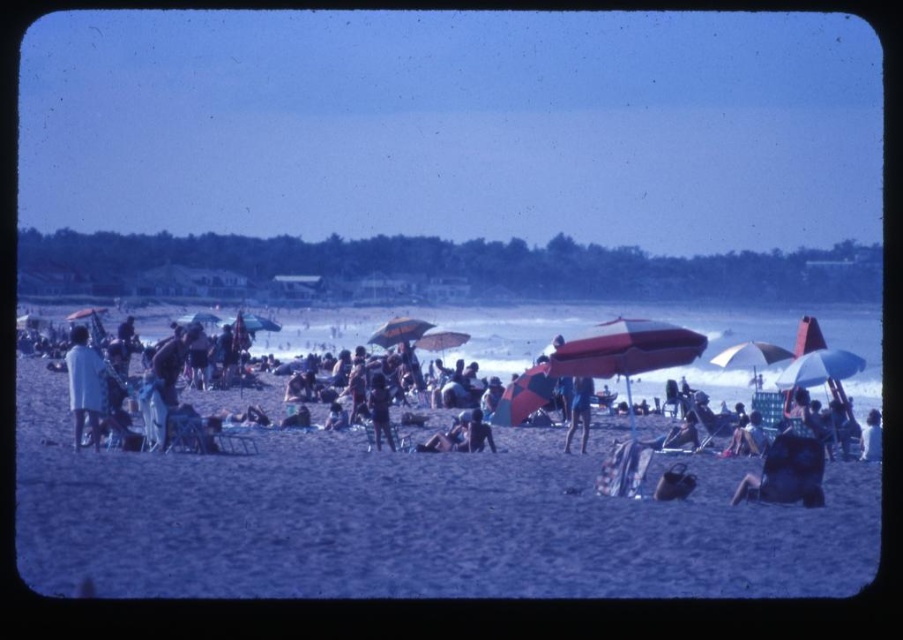
Where is `yellow fabric umbrella at center`? yellow fabric umbrella at center is located at coordinates (399, 332).

Looking at this image, can you confirm if yellow fabric umbrella at center is positioned to the right of red fabric umbrella at center?

Correct, you'll find yellow fabric umbrella at center to the right of red fabric umbrella at center.

You are a GUI agent. You are given a task and a screenshot of the screen. Output one action in this format:
    pyautogui.click(x=<x>, y=<y>)
    Task: Click on the yellow fabric umbrella at center
    This screenshot has width=903, height=640.
    Given the screenshot: What is the action you would take?
    pyautogui.click(x=399, y=332)

The image size is (903, 640). Identify the location of yellow fabric umbrella at center. (399, 332).

Locate an element on the screen. This screenshot has height=640, width=903. white matte shirt at left is located at coordinates (85, 385).

Does dark blue fabric at center have a lesser height compared to red fabric umbrella at center?

In fact, dark blue fabric at center may be taller than red fabric umbrella at center.

Does dark blue fabric at center have a greater width compared to red fabric umbrella at center?

Incorrect, dark blue fabric at center's width does not surpass red fabric umbrella at center's.

Which is in front, point (376, 422) or point (248, 316)?

Point (376, 422)

This screenshot has height=640, width=903. Identify the location of dark blue fabric at center. (379, 410).